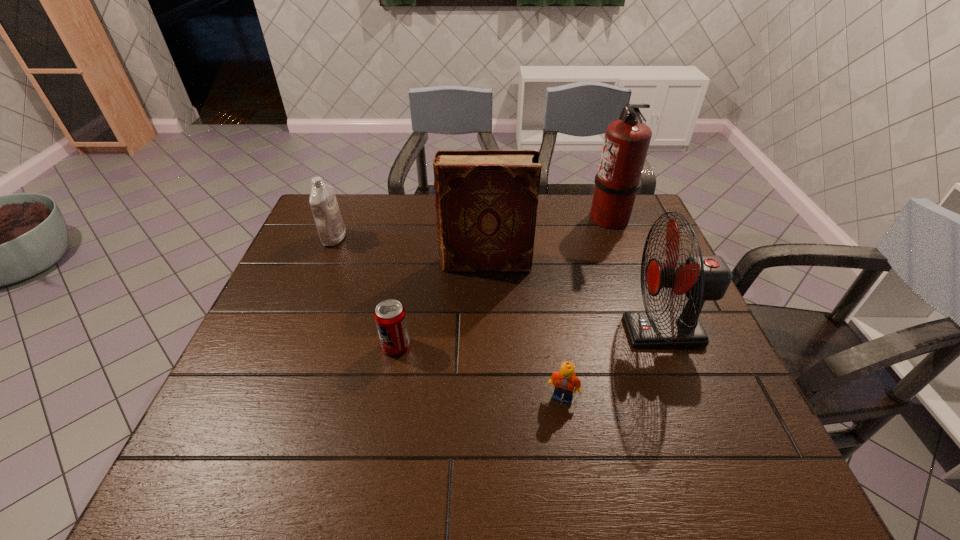
This screenshot has width=960, height=540. Identify the location of free space located 0.400m on the spine side of the third farthest object. (303, 263).

Where is `free spot located on the spine side of the third farthest object`? The image size is (960, 540). free spot located on the spine side of the third farthest object is located at coordinates (396, 263).

Where is `vacant space located 0.100m on the spine side of the third farthest object`? The image size is (960, 540). vacant space located 0.100m on the spine side of the third farthest object is located at coordinates (405, 263).

The width and height of the screenshot is (960, 540). I want to click on blank space located 0.090m on the front-facing side of the fan, so click(x=590, y=332).

This screenshot has width=960, height=540. What are the coordinates of `vacant area situated 0.110m on the front-facing side of the fan` in the screenshot? It's located at (583, 332).

This screenshot has width=960, height=540. I want to click on vacant region located 0.130m on the front-facing side of the fan, so click(574, 332).

Locate an element on the screen. The width and height of the screenshot is (960, 540). vacant region located on the back of the third shortest object is located at coordinates (352, 194).

Where is `vacant area situated 0.070m on the front of the soda can`? This screenshot has width=960, height=540. vacant area situated 0.070m on the front of the soda can is located at coordinates (390, 382).

This screenshot has width=960, height=540. I want to click on free space located on the front-facing side of the Lego, so click(x=577, y=487).

This screenshot has width=960, height=540. Identify the location of fire extinguisher positioned at the far edge. (626, 142).